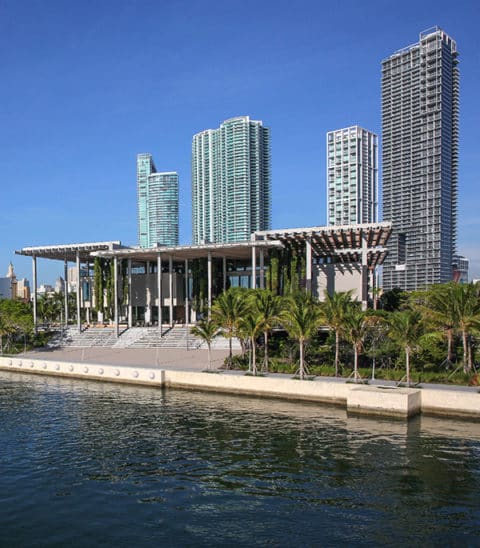
Find the location of a particular element. The height and width of the screenshot is (548, 480). pillars is located at coordinates (160, 279), (114, 293), (79, 284), (33, 286).